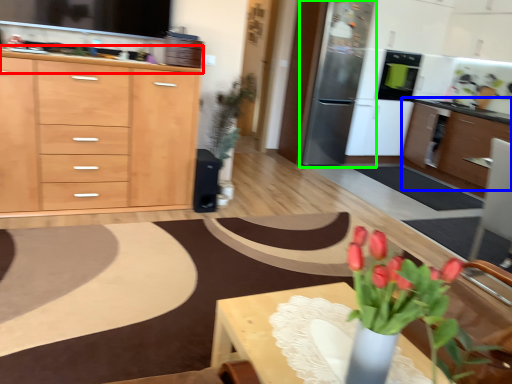
Question: Based on their relative distances, which object is nearer to countertop (highlighted by a red box)? Choose from cabinetry (highlighted by a blue box) and appliance (highlighted by a green box).

Choices:
 (A) cabinetry
 (B) appliance

Answer: (B)